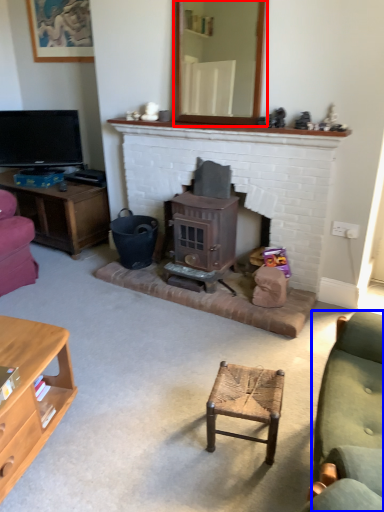
Question: Which point is further to the camera, mirror (highlighted by a red box) or studio couch (highlighted by a blue box)?

Choices:
 (A) mirror
 (B) studio couch

Answer: (A)